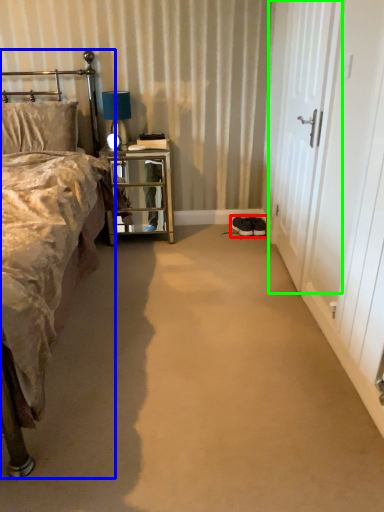
Question: Estimate the real-world distances between objects in this image. Which object is farther from footwear (highlighted by a red box), bed (highlighted by a blue box) or screen door (highlighted by a green box)?

Choices:
 (A) bed
 (B) screen door

Answer: (A)